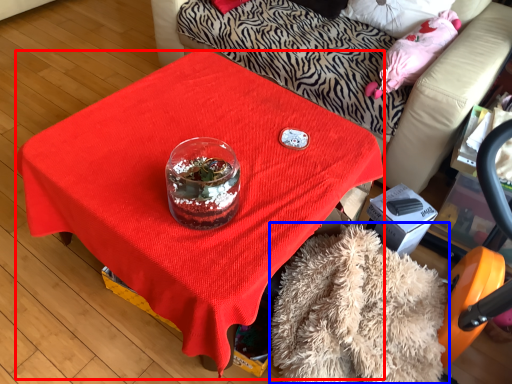
Question: Which object is closer to the camera taking this photo, desk (highlighted by a red box) or blanket (highlighted by a blue box)?

Choices:
 (A) desk
 (B) blanket

Answer: (B)